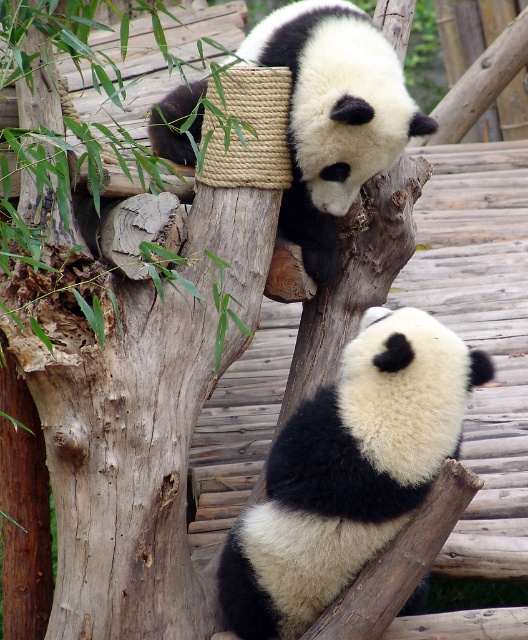
Is black fuzzy panda at center thinner than black and white fur panda at upper center?

Yes.

Between point (285, 524) and point (365, 42), which one is positioned behind?

Point (365, 42)

At what (x,y) coordinates should I click in order to perform the action: click on black fuzzy panda at center. Please return your answer as a coordinate pair (x, y). This screenshot has height=640, width=528. Looking at the image, I should click on (347, 472).